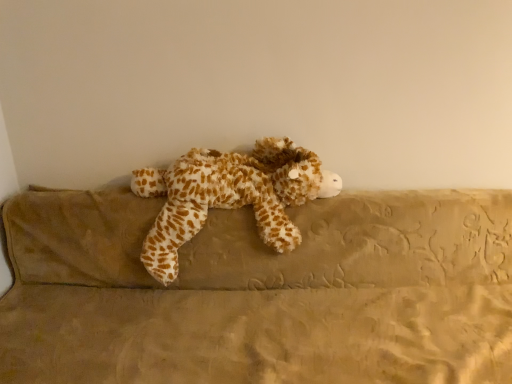
Question: Which direction should I rotate to look at fuzzy brown and white stuffed animal at center?

Choices:
 (A) right
 (B) left

Answer: (B)

Question: Considering the relative sizes of brown plush couch at center and fuzzy brown and white stuffed animal at center in the image provided, is brown plush couch at center taller than fuzzy brown and white stuffed animal at center?

Choices:
 (A) no
 (B) yes

Answer: (B)

Question: Is brown plush couch at center looking in the opposite direction of fuzzy brown and white stuffed animal at center?

Choices:
 (A) no
 (B) yes

Answer: (B)

Question: Does brown plush couch at center lie in front of fuzzy brown and white stuffed animal at center?

Choices:
 (A) no
 (B) yes

Answer: (B)

Question: Does brown plush couch at center have a lesser width compared to fuzzy brown and white stuffed animal at center?

Choices:
 (A) yes
 (B) no

Answer: (B)

Question: Considering the relative sizes of brown plush couch at center and fuzzy brown and white stuffed animal at center in the image provided, is brown plush couch at center bigger than fuzzy brown and white stuffed animal at center?

Choices:
 (A) yes
 (B) no

Answer: (A)

Question: From a real-world perspective, is brown plush couch at center beneath fuzzy brown and white stuffed animal at center?

Choices:
 (A) no
 (B) yes

Answer: (B)

Question: Is fuzzy brown and white stuffed animal at center turned away from brown plush couch at center?

Choices:
 (A) yes
 (B) no

Answer: (A)

Question: Can you confirm if fuzzy brown and white stuffed animal at center is smaller than brown plush couch at center?

Choices:
 (A) no
 (B) yes

Answer: (B)

Question: Can you confirm if fuzzy brown and white stuffed animal at center is thinner than brown plush couch at center?

Choices:
 (A) yes
 (B) no

Answer: (A)

Question: Is fuzzy brown and white stuffed animal at center positioned far away from brown plush couch at center?

Choices:
 (A) no
 (B) yes

Answer: (A)

Question: Is the position of fuzzy brown and white stuffed animal at center less distant than that of brown plush couch at center?

Choices:
 (A) no
 (B) yes

Answer: (A)

Question: Can you confirm if fuzzy brown and white stuffed animal at center is shorter than brown plush couch at center?

Choices:
 (A) yes
 (B) no

Answer: (A)

Question: Relative to fuzzy brown and white stuffed animal at center, is brown plush couch at center in front or behind?

Choices:
 (A) behind
 (B) front

Answer: (B)